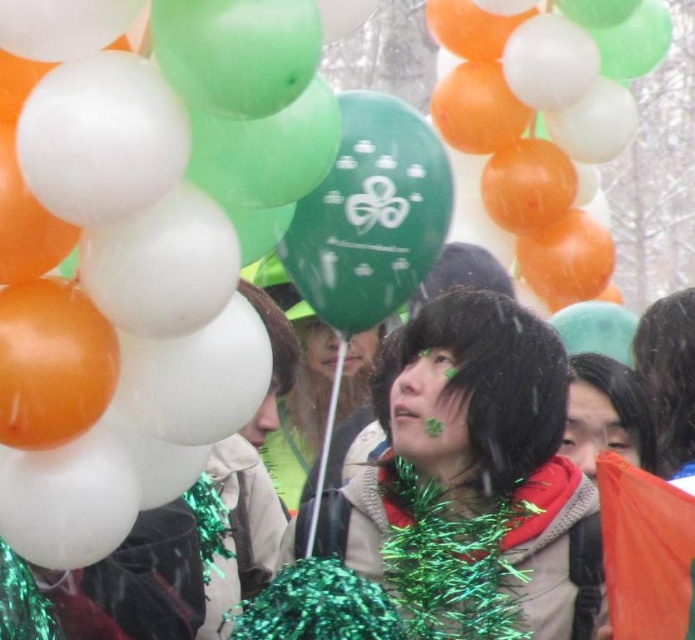
Question: Can you confirm if shiny green tinsel at center is positioned to the right of matte black scarf at center?

Choices:
 (A) no
 (B) yes

Answer: (A)

Question: Is shiny green tinsel at center above matte black scarf at center?

Choices:
 (A) no
 (B) yes

Answer: (A)

Question: Which object appears closest to the camera in this image?

Choices:
 (A) matte black scarf at center
 (B) shiny green tinsel at center

Answer: (B)

Question: Can you confirm if shiny green tinsel at center is wider than matte black scarf at center?

Choices:
 (A) no
 (B) yes

Answer: (A)